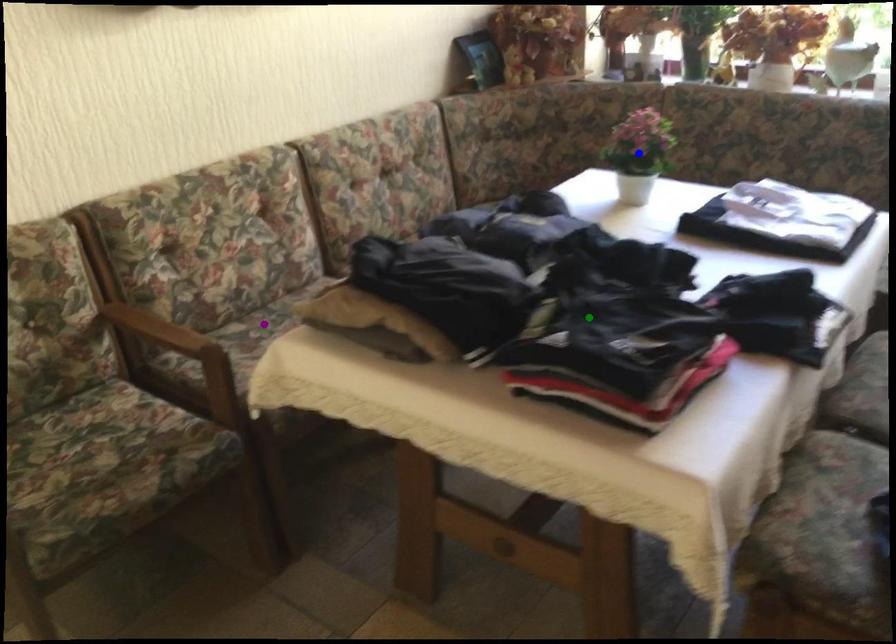
Order these from nearest to farthest:
blue point
green point
purple point

purple point, blue point, green point